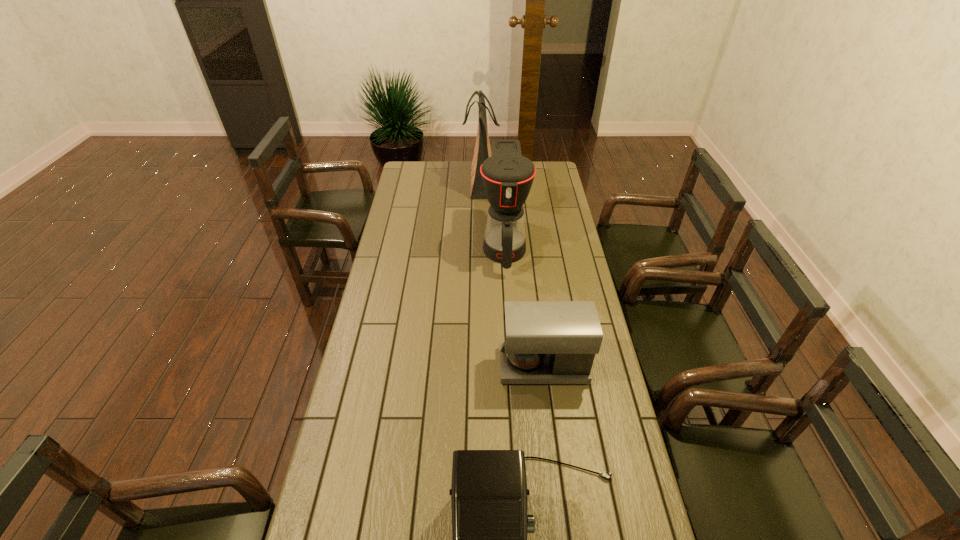
You are a GUI agent. You are given a task and a screenshot of the screen. Output one action in this format:
    pyautogui.click(x=<x>, y=<y>)
    Task: Click on the shopping bag
    
    Given the screenshot: What is the action you would take?
    pyautogui.click(x=482, y=151)

This screenshot has width=960, height=540. Identify the location of the tallest coffee maker. (507, 176).

I want to click on the farthest coffee maker, so [507, 176].

At what (x,y) coordinates should I click in order to perform the action: click on the second nearest object. Please return your answer as a coordinate pair (x, y). This screenshot has height=540, width=960. Looking at the image, I should click on (545, 342).

This screenshot has height=540, width=960. Identify the location of vacant space positioned 0.050m on the front-facing side of the shopping bag. (454, 181).

Locate an element on the screen. vacant space situated on the front-facing side of the shopping bag is located at coordinates (448, 181).

At what (x,y) coordinates should I click in order to perform the action: click on free spot located 0.150m on the front-facing side of the shopping bag. Please return your answer as a coordinate pair (x, y). The image size is (960, 540). Looking at the image, I should click on (436, 181).

This screenshot has width=960, height=540. Identify the location of vacant region located pour from the carafe of the third nearest object. (511, 354).

Locate an element on the screen. free space located on the carafe side of the third farthest object is located at coordinates (452, 366).

Where is `vacant space located 0.090m on the carafe side of the third farthest object`? This screenshot has width=960, height=540. vacant space located 0.090m on the carafe side of the third farthest object is located at coordinates pyautogui.click(x=473, y=366).